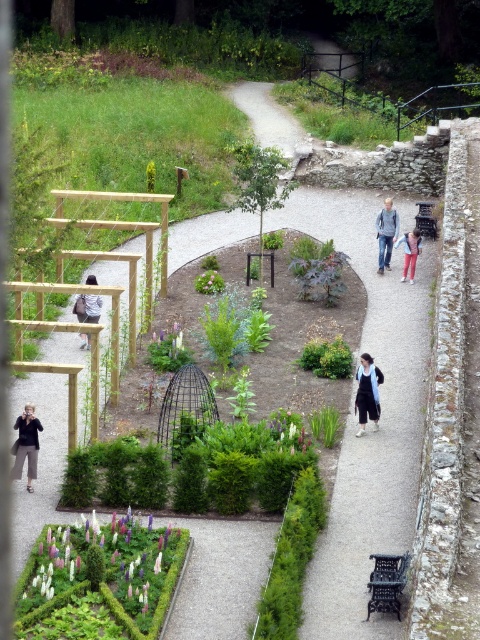
Who is lower down, green leafy hedge at center or gray cotton shirt at center-right?

green leafy hedge at center is lower down.

Is green leafy hedge at center below gray cotton shirt at center-right?

Correct, green leafy hedge at center is located below gray cotton shirt at center-right.

I want to click on green leafy hedge at center, so click(x=290, y=557).

Does dark gray pants at lower left have a smaller size compared to green leafy plant at center?

Correct, dark gray pants at lower left occupies less space than green leafy plant at center.

Which is behind, point (36, 445) or point (216, 273)?

The point (216, 273) is behind.

The height and width of the screenshot is (640, 480). Find the location of `dark gray pants at lower left`. dark gray pants at lower left is located at coordinates (25, 444).

The image size is (480, 640). What are the coordinates of `dark gray pants at lower left` in the screenshot? It's located at (25, 444).

Can you confirm if green leafy bush at center is positioned below matte black backpack at left?

Correct, green leafy bush at center is located below matte black backpack at left.

The width and height of the screenshot is (480, 640). I want to click on green leafy bush at center, so click(x=326, y=358).

This screenshot has width=480, height=640. Find the location of `green leafy bush at center`. green leafy bush at center is located at coordinates (326, 358).